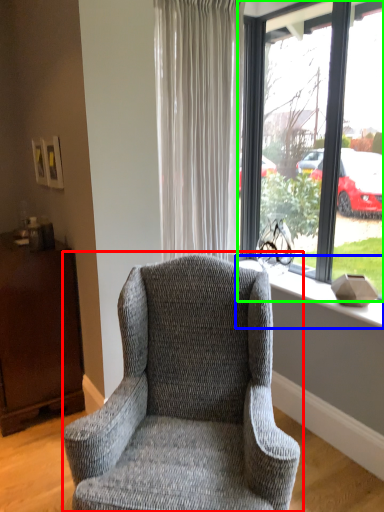
Question: Based on their relative distances, which object is nearer to chair (highlighted by a red box)? Choose from window sill (highlighted by a blue box) and window (highlighted by a green box).

Choices:
 (A) window sill
 (B) window

Answer: (A)